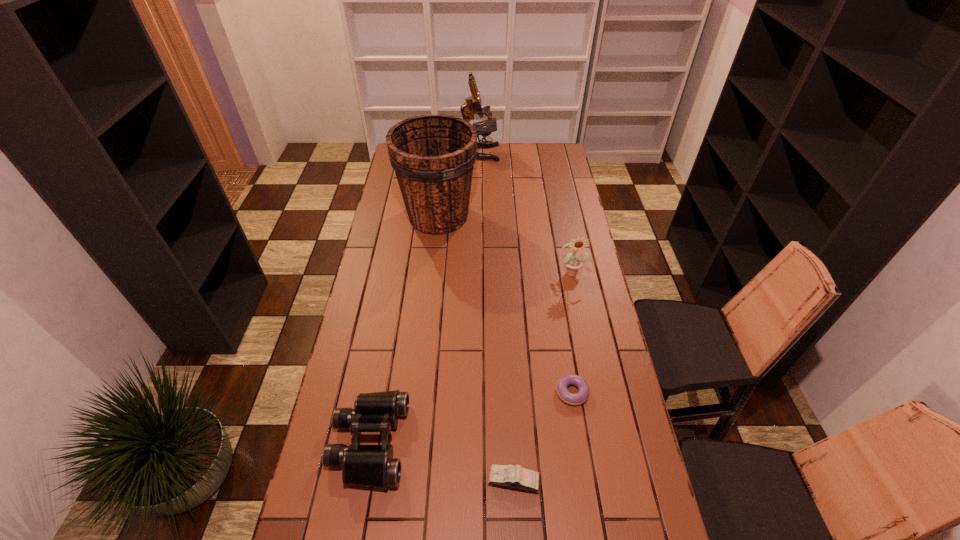
In order to click on free space located 0.350m on the front-facing side of the binoculars in this screenshot , I will do `click(527, 442)`.

Locate an element on the screen. This screenshot has height=540, width=960. vacant area located on the back of the diary is located at coordinates (512, 431).

Image resolution: width=960 pixels, height=540 pixels. I want to click on free location located on the left of the doughnut, so click(479, 392).

This screenshot has width=960, height=540. Find the location of `object that is at the far edge`. object that is at the far edge is located at coordinates (473, 105).

This screenshot has width=960, height=540. In order to click on bucket that is at the left edge in this screenshot , I will do `click(433, 156)`.

The image size is (960, 540). Identify the location of binoculars at the left edge. (373, 466).

Locate an element on the screen. sunflower located at the right edge is located at coordinates (573, 264).

Image resolution: width=960 pixels, height=540 pixels. Find the location of `doughnut that is at the right edge`. doughnut that is at the right edge is located at coordinates (581, 396).

Find the location of a particular element. The image size is (960, 540). vacant space at the left edge of the desktop is located at coordinates (398, 198).

The height and width of the screenshot is (540, 960). Identify the location of vacant space at the right edge of the desktop. (583, 327).